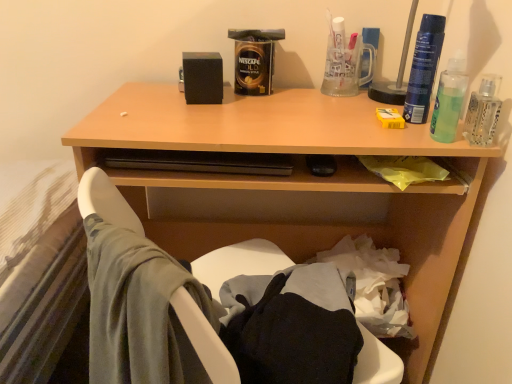
Identify the location of vacant space to the left of green translucent liquid at upper right. (385, 133).